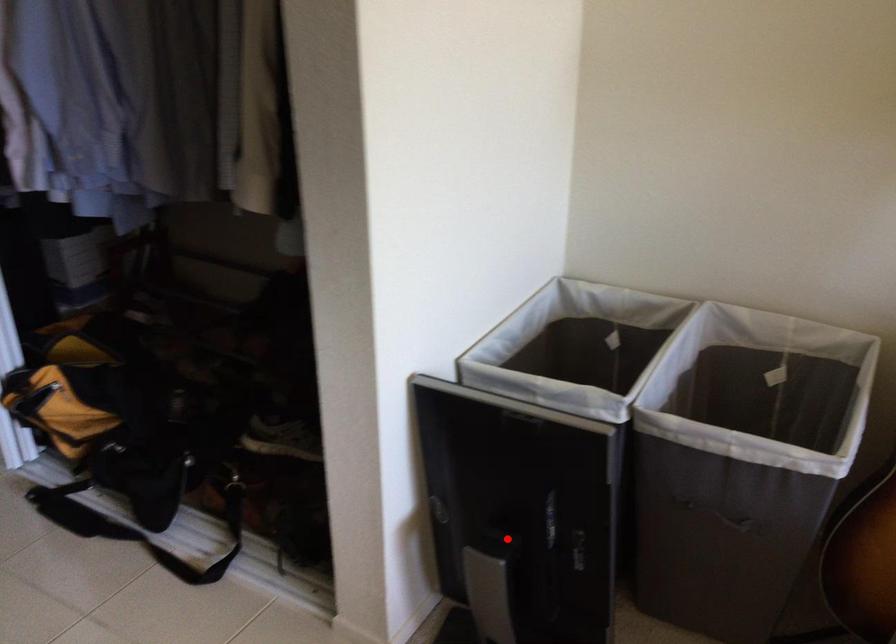
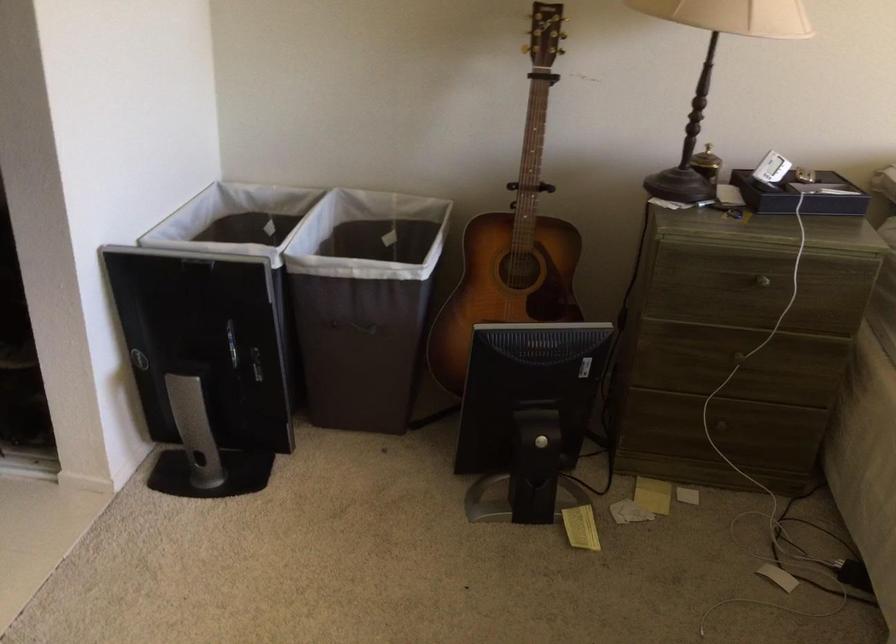
Question: I am providing you with two images of the same scene from different viewpoints. In image1, a red point is highlighted. Considering the same 3D point in image2, which of the following is correct?

Choices:
 (A) It is closer
 (B) It is farther

Answer: (B)